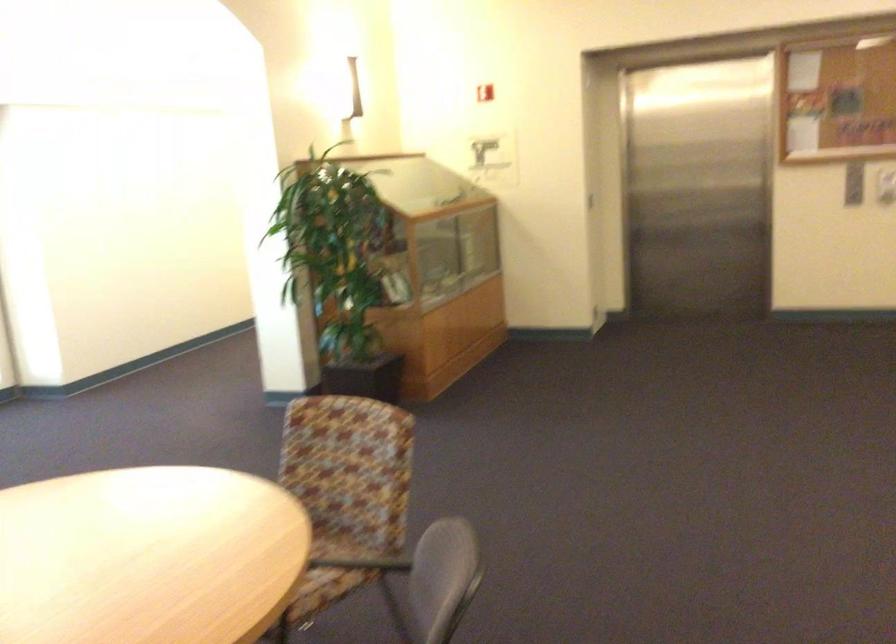
Where would you pull the red fire alarm? Please return your answer as a coordinate pair (x, y).

(485, 91)